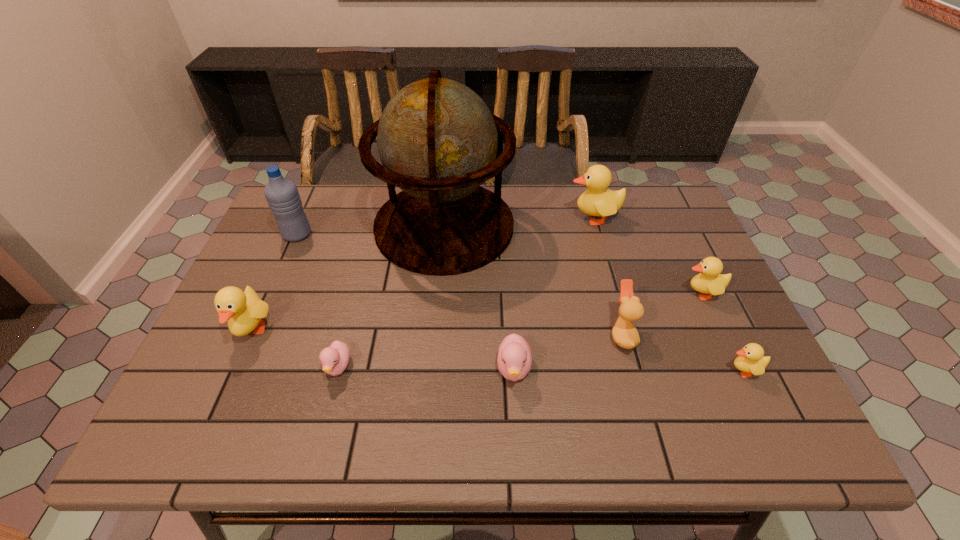
Where is `the fourth duckling from right to left`? the fourth duckling from right to left is located at coordinates (514, 359).

Image resolution: width=960 pixels, height=540 pixels. Find the location of `the bigger pink duckling`. the bigger pink duckling is located at coordinates (514, 359).

Locate an element on the screen. the smallest yellow duckling is located at coordinates (751, 361).

The width and height of the screenshot is (960, 540). Find the location of `the smaller pink duckling`. the smaller pink duckling is located at coordinates click(x=334, y=359).

Locate an element on the screen. This screenshot has height=540, width=960. the left pink duckling is located at coordinates (334, 359).

This screenshot has height=540, width=960. Find the location of `vacant area situated 0.080m on the front-facing side of the globe`. vacant area situated 0.080m on the front-facing side of the globe is located at coordinates (438, 299).

This screenshot has width=960, height=540. What are the coordinates of `vacant space positioned 0.170m on the right of the eighth shortest object` in the screenshot? It's located at (370, 235).

Where is `vacant space located 0.140m on the front-facing side of the tallest duckling`? vacant space located 0.140m on the front-facing side of the tallest duckling is located at coordinates (521, 218).

Locate an element on the screen. This screenshot has height=540, width=960. vacant space situated 0.130m on the front-facing side of the tallest duckling is located at coordinates (524, 218).

Find the location of a particular element. Image resolution: width=960 pixels, height=540 pixels. vacant space located 0.270m on the front-facing side of the tallest duckling is located at coordinates (479, 218).